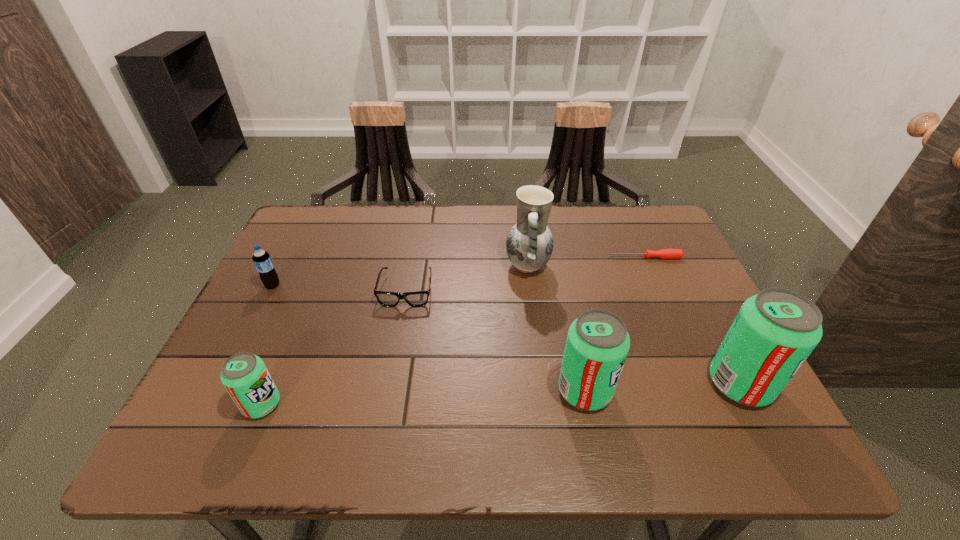
Find the location of a particular element. Image resolution: width=960 pixels, height=540 pixels. vacant region at the far right corner of the desktop is located at coordinates (621, 246).

You are a GUI agent. You are given a task and a screenshot of the screen. Output one action in this format:
    pyautogui.click(x=<x>, y=<y>)
    Task: Click on the vacant space that's between the farthest soda bottle and the second soda bottle from right to left
    The width and height of the screenshot is (960, 540).
    Given the screenshot: What is the action you would take?
    pyautogui.click(x=429, y=338)

Identify the location of vacant area between the screwdriver and the pottery. (587, 261).

Where is `unoccupied area between the second tallest soda bottle and the farthest soda bottle`? This screenshot has height=540, width=960. unoccupied area between the second tallest soda bottle and the farthest soda bottle is located at coordinates (429, 338).

Where is `vacant point located between the pottery and the rightmost soda bottle`? vacant point located between the pottery and the rightmost soda bottle is located at coordinates (634, 325).

Where is `free space between the third shortest soda bottle and the second object from left to right`? Image resolution: width=960 pixels, height=540 pixels. free space between the third shortest soda bottle and the second object from left to right is located at coordinates (423, 397).

Image resolution: width=960 pixels, height=540 pixels. Find the location of `free spot between the third object from left to right and the pottery`. free spot between the third object from left to right and the pottery is located at coordinates (467, 278).

You are a GUI agent. You are given a task and a screenshot of the screen. Output one action in this format:
    pyautogui.click(x=<x>, y=<y>)
    Task: Click on the empty location between the sixth object from right to left and the fifth shortest object
    The width and height of the screenshot is (960, 540).
    Given the screenshot: What is the action you would take?
    pyautogui.click(x=423, y=397)

Where is `vacant region between the sunglasses and the leftmost object`? The height and width of the screenshot is (540, 960). vacant region between the sunglasses and the leftmost object is located at coordinates (340, 288).

Where is `empty space between the third soda bottle from right to left and the sunglasses`? This screenshot has width=960, height=540. empty space between the third soda bottle from right to left and the sunglasses is located at coordinates (334, 347).